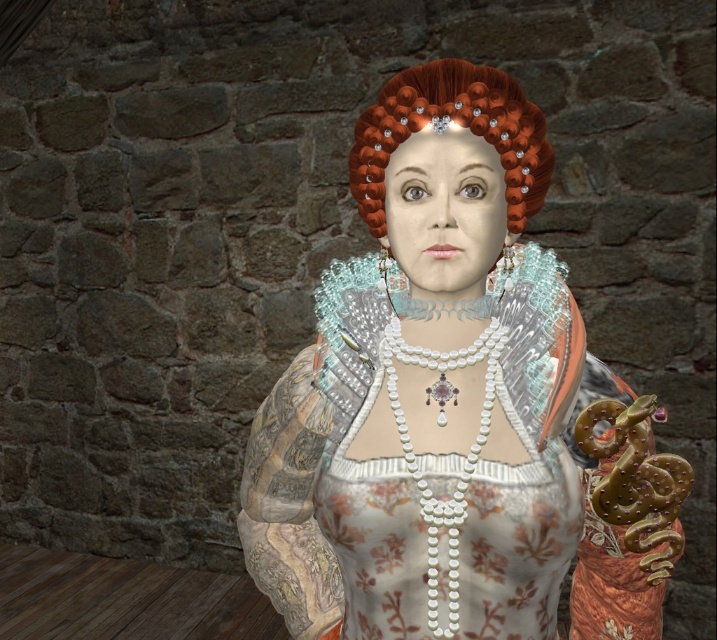
This screenshot has width=717, height=640. I want to click on matte silver gown at center, so click(427, 387).

In the scene shown: Measure the distance between point (442,380) and camera.

Point (442,380) and camera are 1.03 meters apart from each other.

You are a GUI agent. You are given a task and a screenshot of the screen. Output one action in this format:
    pyautogui.click(x=<x>, y=<y>)
    Task: Click on the matte silver gown at center
    
    Given the screenshot: What is the action you would take?
    pyautogui.click(x=427, y=387)